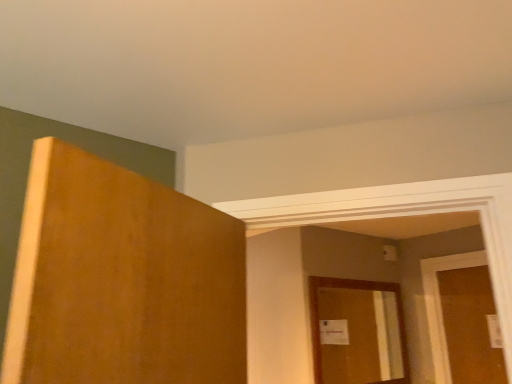
Image resolution: width=512 pixels, height=384 pixels. What do you see at coordinates (362, 337) in the screenshot? I see `wooden mirror at center` at bounding box center [362, 337].

Measure the distance between point (x=331, y=293) and camera.

3.89 meters.

At what (x,y) coordinates should I click in order to perform the action: click on wooden mirror at center. Please return your answer as a coordinate pair (x, y). This screenshot has height=384, width=512. Looking at the image, I should click on (362, 337).

The width and height of the screenshot is (512, 384). In order to click on wooden mirror at center in this screenshot , I will do `click(362, 337)`.